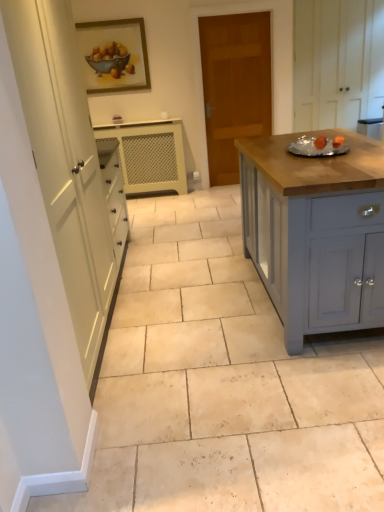
Question: Does white textured cabinet at center, which is the 1th cabinetry in back-to-front order, lie behind matte gray cabinet at right, marked as the second cabinetry in a right-to-left arrangement?

Choices:
 (A) no
 (B) yes

Answer: (B)

Question: Can you confirm if white textured cabinet at center, which is the 1th cabinetry in back-to-front order, is bigger than matte gray cabinet at right, marked as the second cabinetry in a right-to-left arrangement?

Choices:
 (A) no
 (B) yes

Answer: (A)

Question: Is matte gray cabinet at right, marked as the second cabinetry in a right-to-left arrangement, located within white textured cabinet at center, the second cabinetry from the bottom?

Choices:
 (A) yes
 (B) no

Answer: (B)

Question: From the image's perspective, is white textured cabinet at center, which is counted as the 3th cabinetry, starting from the right, on matte gray cabinet at right, arranged as the third cabinetry when viewed from the back?

Choices:
 (A) yes
 (B) no

Answer: (A)

Question: Is white textured cabinet at center, which is counted as the 3th cabinetry, starting from the right, oriented away from matte gray cabinet at right, the 1th cabinetry when ordered from front to back?

Choices:
 (A) no
 (B) yes

Answer: (A)

Question: Considering their positions, is matte gray cabinet at right, marked as the second cabinetry in a right-to-left arrangement, located in front of or behind white tile floor at center?

Choices:
 (A) front
 (B) behind

Answer: (B)

Question: In terms of width, does matte gray cabinet at right, which appears as the third cabinetry when viewed from the top, look wider or thinner when compared to white tile floor at center?

Choices:
 (A) wide
 (B) thin

Answer: (B)

Question: Is matte gray cabinet at right, which appears as the third cabinetry when viewed from the top, inside the boundaries of white tile floor at center, or outside?

Choices:
 (A) inside
 (B) outside

Answer: (B)

Question: From their relative heights in the image, would you say matte gray cabinet at right, which appears as the third cabinetry when viewed from the top, is taller or shorter than white tile floor at center?

Choices:
 (A) tall
 (B) short

Answer: (A)

Question: From their relative heights in the image, would you say wooden framed painting at upper center is taller or shorter than white textured cabinet at center, the 3th cabinetry positioned from the front?

Choices:
 (A) short
 (B) tall

Answer: (A)

Question: From a real-world perspective, relative to white textured cabinet at center, which is the 1th cabinetry in back-to-front order, is wooden framed painting at upper center vertically above or below?

Choices:
 (A) above
 (B) below

Answer: (A)

Question: Is wooden framed painting at upper center situated inside white textured cabinet at center, which is counted as the 3th cabinetry, starting from the right, or outside?

Choices:
 (A) inside
 (B) outside

Answer: (B)

Question: Is point (109, 86) positioned closer to the camera than point (130, 163)?

Choices:
 (A) closer
 (B) farther

Answer: (A)

Question: From a real-world perspective, is white textured cabinet at center, which is the 1th cabinetry in back-to-front order, physically located above or below white wood cabinet at upper right, the first cabinetry in the top-to-bottom sequence?

Choices:
 (A) above
 (B) below

Answer: (B)

Question: In terms of height, does white textured cabinet at center, the 3th cabinetry positioned from the front, look taller or shorter compared to white wood cabinet at upper right, which is the 2th cabinetry in back-to-front order?

Choices:
 (A) short
 (B) tall

Answer: (A)